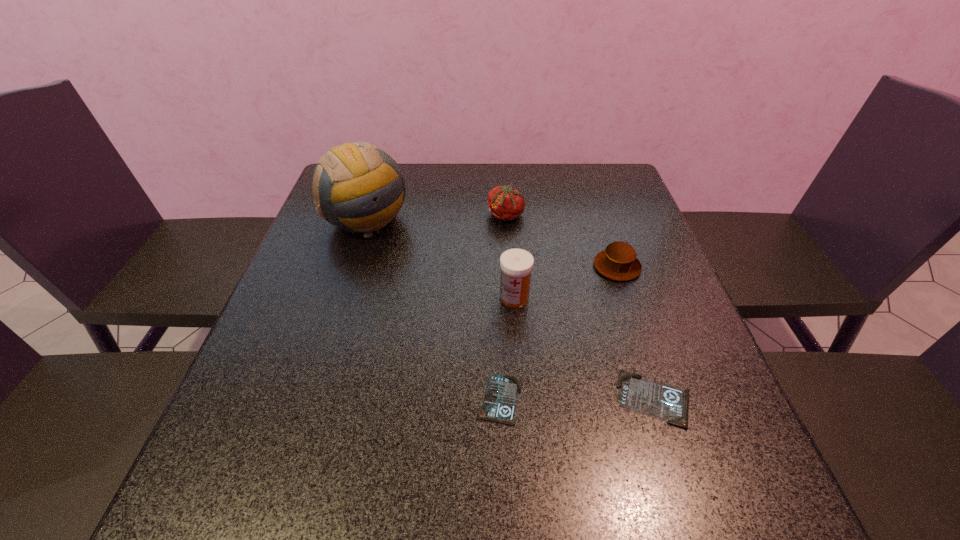
Where is `medicine`? The width and height of the screenshot is (960, 540). medicine is located at coordinates (516, 265).

Locate an element on the screen. free location located 0.210m on the right of the shortest object is located at coordinates (641, 399).

The image size is (960, 540). I want to click on free space located on the left of the second shortest object, so click(577, 399).

Identify the location of vacant space located on the right of the leftmost object. The height and width of the screenshot is (540, 960). (516, 220).

You are a GUI agent. You are given a task and a screenshot of the screen. Output one action in this format:
    pyautogui.click(x=<x>, y=<y>)
    Task: Click on the vacant space positioned on the left of the fourth shortest object
    This screenshot has width=960, height=540.
    Given the screenshot: What is the action you would take?
    pyautogui.click(x=436, y=215)

This screenshot has height=540, width=960. Find the location of `vacant space located 0.340m on the back of the third farthest object`. vacant space located 0.340m on the back of the third farthest object is located at coordinates (588, 180).

Image resolution: width=960 pixels, height=540 pixels. What are the coordinates of `vacant space located 0.100m on the front of the second tallest object` in the screenshot? It's located at click(x=518, y=346).

Where is `volleyball that is at the far edge`? volleyball that is at the far edge is located at coordinates (359, 187).

What are the coordinates of `tomato that is at the far edge` in the screenshot? It's located at (505, 203).

Locate an element on the screen. Image resolution: width=960 pixels, height=540 pixels. object located in the left edge section of the desktop is located at coordinates (359, 187).